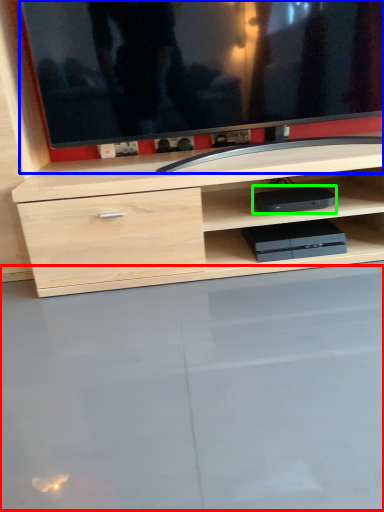
Question: Which object is positioned farthest from glass table (highlighted by a red box)? Select from television (highlighted by a blue box) and equipment (highlighted by a green box).

Choices:
 (A) television
 (B) equipment

Answer: (A)